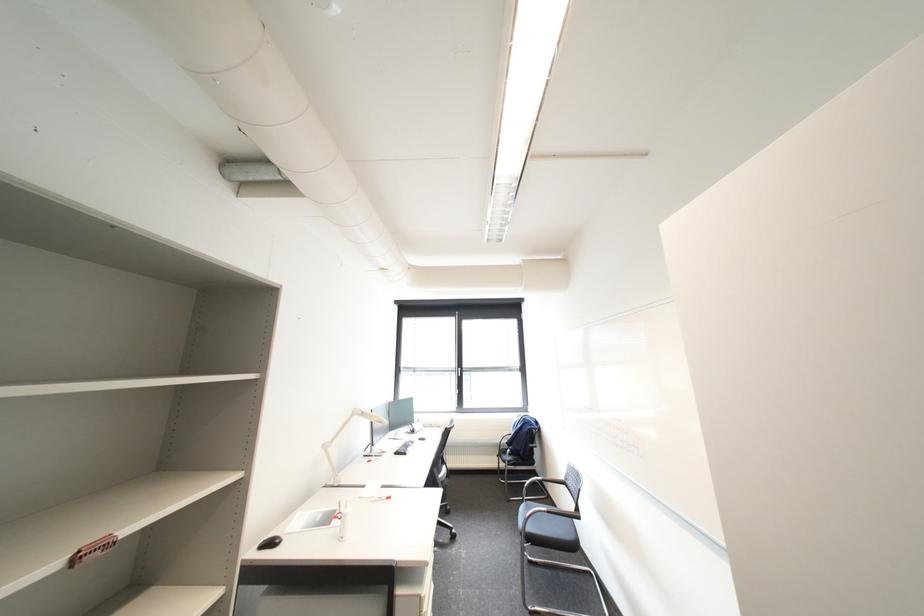
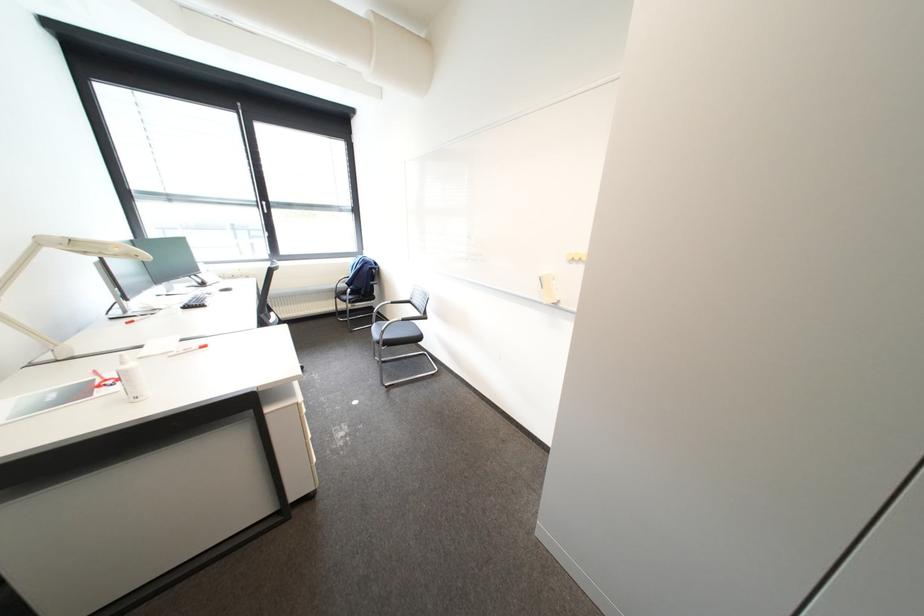
The images are taken continuously from a first-person perspective. In which direction is your viewpoint rotating?

The camera rotated toward right-down.